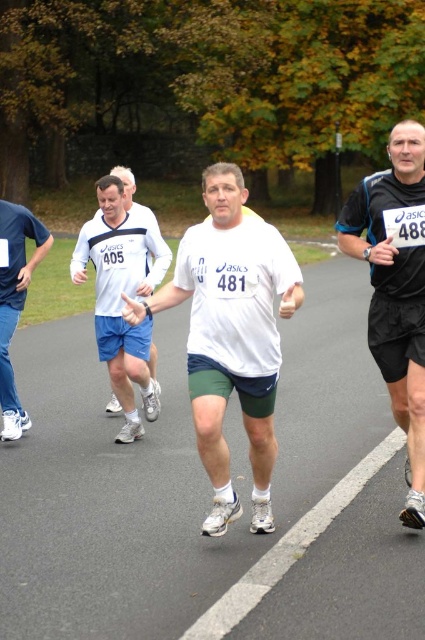
You are a runner in the race and you see two points marked on the road ahead. The first point is at coordinate point(271,225) and the second is at point(379,328). Which point should you reach first while running forward?

You should reach point(271,225) first because it is in front of point(379,328) along your running path.